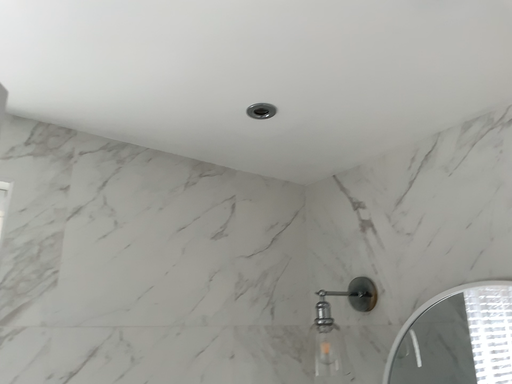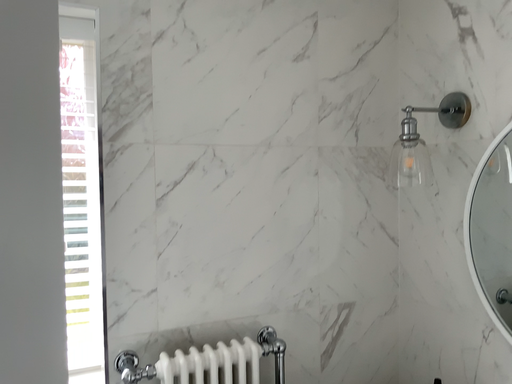
Question: Which way did the camera rotate in the video?

Choices:
 (A) rotated upward
 (B) rotated downward

Answer: (B)